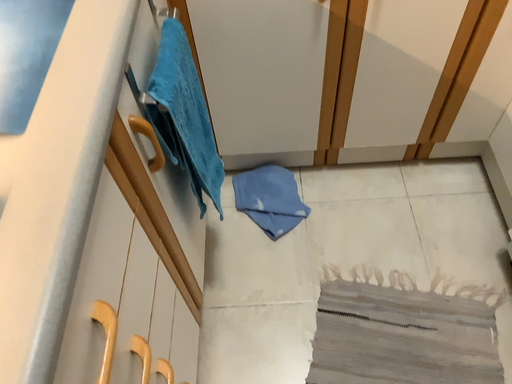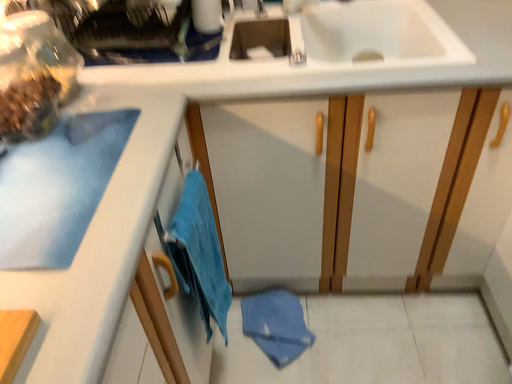
Question: Which way did the camera rotate in the video?

Choices:
 (A) rotated downward
 (B) rotated upward

Answer: (B)